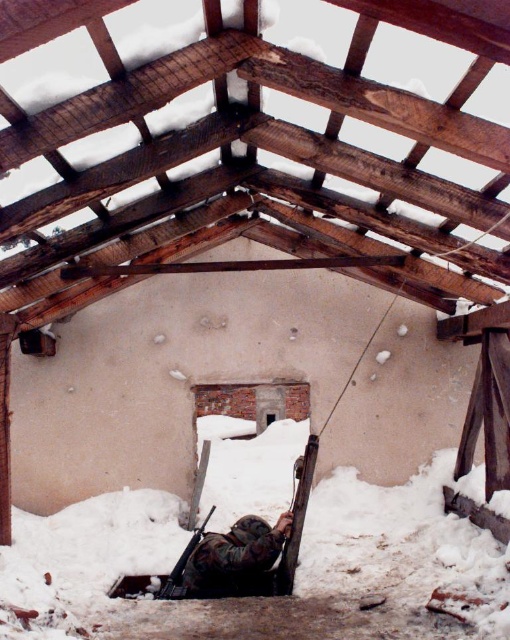
The image size is (510, 640). What do you see at coordinates (400, 545) in the screenshot? I see `white powdery snow at lower center` at bounding box center [400, 545].

Which is behind, point (170, 525) or point (282, 564)?

The point (170, 525) is more distant.

I want to click on white powdery snow at lower center, so click(x=400, y=545).

Does white powdery snow at lower center appear on the right side of camouflage fabric rifle at lower center?

Yes, white powdery snow at lower center is to the right of camouflage fabric rifle at lower center.

Can you confirm if white powdery snow at lower center is positioned above camouflage fabric rifle at lower center?

Yes.

Identify the location of white powdery snow at lower center. Image resolution: width=510 pixels, height=640 pixels. (400, 545).

At what (x,y) coordinates should I click in order to perform the action: click on white powdery snow at lower center. Please return your answer as a coordinate pair (x, y). This screenshot has height=640, width=510. Looking at the image, I should click on (400, 545).

Is point (503, 186) farther from viewer compared to point (231, 529)?

That is False.

Which is in front, point (424, 51) or point (211, 554)?

Point (424, 51) is in front.

Which is in front, point (168, 136) or point (273, 572)?

Positioned in front is point (168, 136).

You are a GUI agent. You are given a task and a screenshot of the screen. Output one action in this format:
    pyautogui.click(x=<x>, y=<y>)
    Task: Click on the brown wooden beams at upper center
    
    Given the screenshot: What is the action you would take?
    pyautogui.click(x=253, y=138)